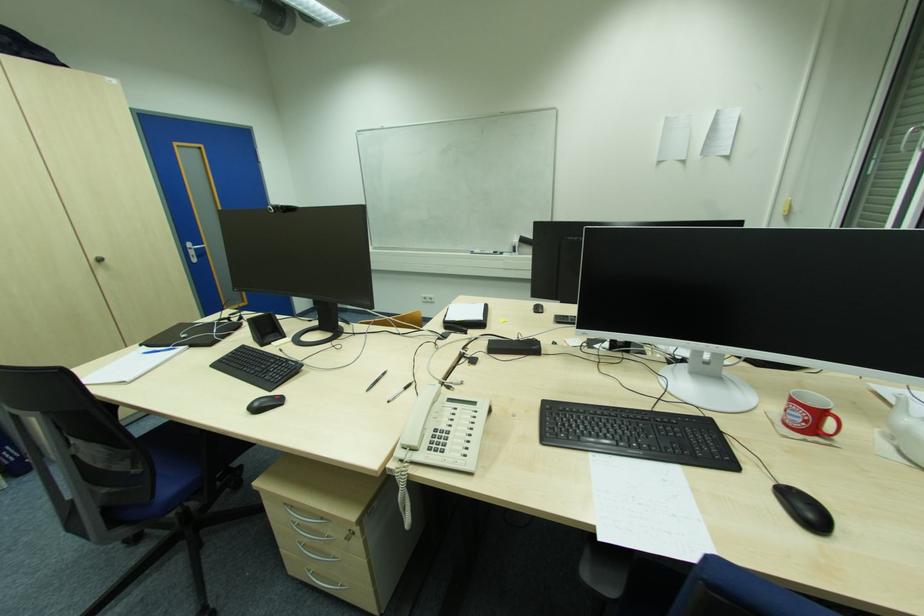
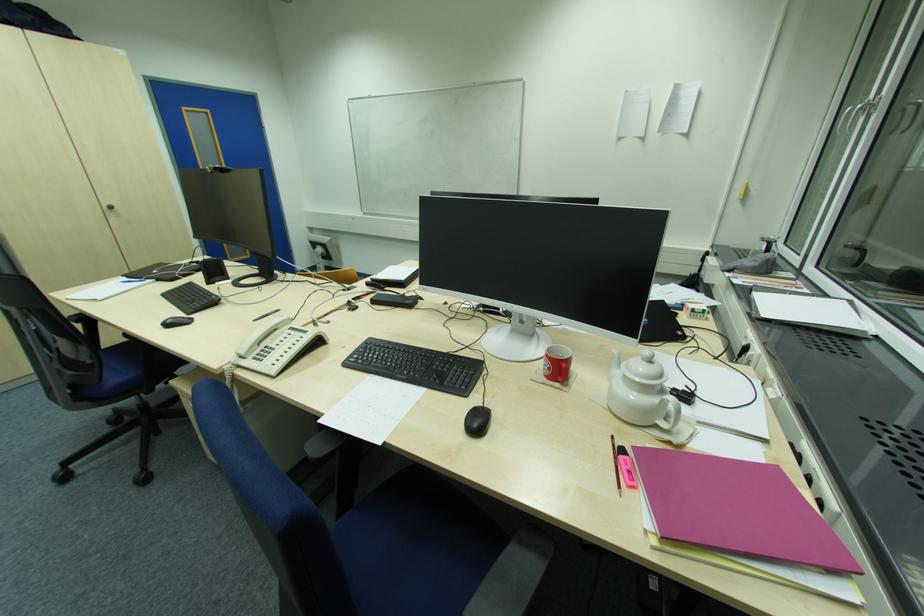
The point at (266, 395) is marked in the first image. Where is the corresponding point in the second image?

(185, 317)